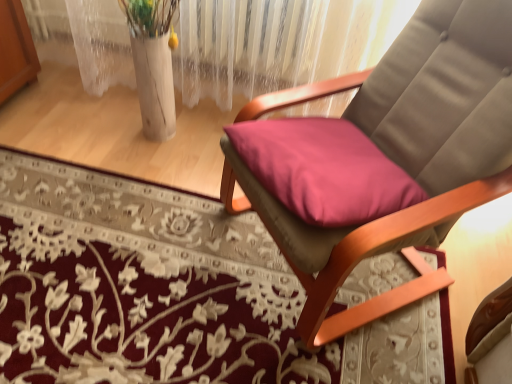
Identify the location of free space to the left of matte pink cushion at center. The height and width of the screenshot is (384, 512). (158, 266).